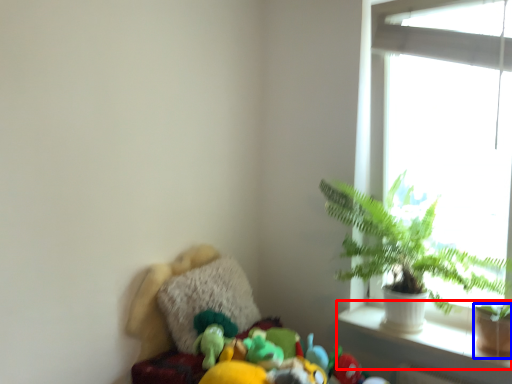
Question: Among these objects, which one is nearest to the camera, window sill (highlighted by a red box) or flowerpot (highlighted by a blue box)?

Choices:
 (A) window sill
 (B) flowerpot

Answer: (A)